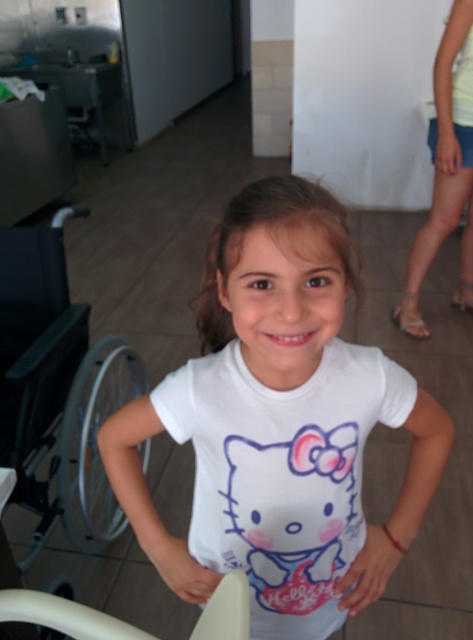
Question: Is white cotton t-shirt at center bigger than white plastic chair at lower center?

Choices:
 (A) yes
 (B) no

Answer: (A)

Question: Which point appears farthest from the camera in this image?

Choices:
 (A) (355, 400)
 (B) (308, 433)

Answer: (A)

Question: Does white cotton t-shirt at center have a lesser width compared to white plastic chair at lower center?

Choices:
 (A) yes
 (B) no

Answer: (A)

Question: Which of the following is the farthest from the observer?

Choices:
 (A) silver metallic wheelchair at left
 (B) white matte t-shirt at center
 (C) light yellow fabric shorts at right

Answer: (C)

Question: Does white matte t-shirt at center have a greater width compared to light yellow fabric shorts at right?

Choices:
 (A) no
 (B) yes

Answer: (B)

Question: Based on their relative distances, which object is nearer to the white cotton t-shirt at center?

Choices:
 (A) light yellow fabric shorts at right
 (B) silver metallic wheelchair at left

Answer: (B)